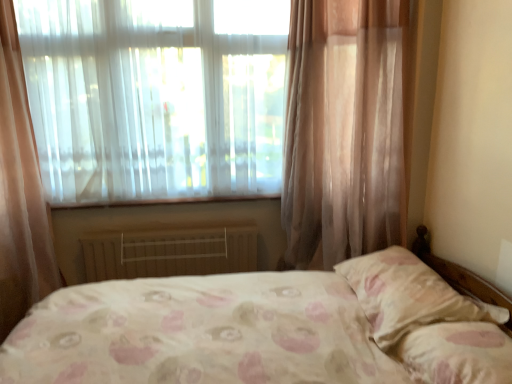
Locate an element on the screen. Image resolution: width=512 pixels, height=384 pixels. white painted metal radiator at lower center is located at coordinates (170, 251).

Describe the element at coordinates (457, 353) in the screenshot. This screenshot has width=512, height=384. I see `pink floral fabric pillow at lower right, which is the second pillow in back-to-front order` at that location.

The image size is (512, 384). Find the location of `pink floral fabric pillow at right, positioned as the first pillow in back-to-front order`. pink floral fabric pillow at right, positioned as the first pillow in back-to-front order is located at coordinates (408, 295).

Identify the location of translucent fabric at upper left. Image resolution: width=512 pixels, height=384 pixels. (156, 96).

Find the location of a particular element. white painted metal radiator at lower center is located at coordinates (170, 251).

What's the angular difference between pink floral fabric pillow at lower right, the 1th pillow from the front, and pink floral fabric pillow at right, positioned as the first pillow in back-to-front order,'s facing directions?

They differ by 0.00109 degrees in their facing directions.

Is pink floral fabric pillow at lower right, the 1th pillow from the front, not inside pink floral fabric pillow at right, positioned as the first pillow in back-to-front order?

Absolutely, pink floral fabric pillow at lower right, the 1th pillow from the front, is external to pink floral fabric pillow at right, positioned as the first pillow in back-to-front order.

Considering the positions of points (469, 365) and (404, 282), is point (469, 365) farther from camera compared to point (404, 282)?

No, (469, 365) is in front of (404, 282).

How many degrees apart are the facing directions of translucent fabric at upper left and white painted metal radiator at lower center?

The angular difference between translucent fabric at upper left and white painted metal radiator at lower center is 0.761 degrees.

Are translucent fabric at upper left and white painted metal radiator at lower center beside each other?

translucent fabric at upper left and white painted metal radiator at lower center are not in contact.

From their relative heights in the image, would you say translucent fabric at upper left is taller or shorter than white painted metal radiator at lower center?

translucent fabric at upper left is taller than white painted metal radiator at lower center.

Is translucent fabric at upper left inside the boundaries of pink floral fabric pillow at right, the 2th pillow in the front-to-back sequence, or outside?

translucent fabric at upper left exists outside the volume of pink floral fabric pillow at right, the 2th pillow in the front-to-back sequence.

Is translucent fabric at upper left bigger than pink floral fabric pillow at right, positioned as the first pillow in back-to-front order?

Indeed, translucent fabric at upper left has a larger size compared to pink floral fabric pillow at right, positioned as the first pillow in back-to-front order.

Which object is positioned more to the right, translucent fabric at upper left or pink floral fabric pillow at right, positioned as the first pillow in back-to-front order?

From the viewer's perspective, pink floral fabric pillow at right, positioned as the first pillow in back-to-front order, appears more on the right side.

From the image's perspective, relative to pink floral fabric pillow at right, the 2th pillow in the front-to-back sequence, is translucent fabric at upper left above or below?

translucent fabric at upper left is situated higher than pink floral fabric pillow at right, the 2th pillow in the front-to-back sequence, in the image.

Based on their positions, is white painted metal radiator at lower center located to the left or right of pink floral fabric pillow at lower right, which is the second pillow in back-to-front order?

Clearly, white painted metal radiator at lower center is on the left of pink floral fabric pillow at lower right, which is the second pillow in back-to-front order, in the image.

From a real-world perspective, is white painted metal radiator at lower center physically located above or below pink floral fabric pillow at lower right, the 1th pillow from the front?

Clearly, from a real-world perspective, white painted metal radiator at lower center is below pink floral fabric pillow at lower right, the 1th pillow from the front.

Is white painted metal radiator at lower center facing away from pink floral fabric pillow at lower right, the 1th pillow from the front?

No, pink floral fabric pillow at lower right, the 1th pillow from the front, is not at the back of white painted metal radiator at lower center.

Is white painted metal radiator at lower center spatially inside translucent fabric at upper left, or outside of it?

white painted metal radiator at lower center is located beyond the bounds of translucent fabric at upper left.

At what (x,y) coordinates should I click in order to perform the action: click on radiator that appears on the left of translucent fabric at upper left. Please return your answer as a coordinate pair (x, y). Looking at the image, I should click on (170, 251).

Between point (229, 250) and point (91, 127), which one is positioned behind?

The point (229, 250) is more distant.

From the image's perspective, is white painted metal radiator at lower center located above or below translucent fabric at upper left?

white painted metal radiator at lower center is situated lower than translucent fabric at upper left in the image.

From a real-world perspective, is pink floral fabric pillow at lower right, the 1th pillow from the front, above or below translucent fabric at upper left?

Clearly, from a real-world perspective, pink floral fabric pillow at lower right, the 1th pillow from the front, is below translucent fabric at upper left.

From the image's perspective, is pink floral fabric pillow at lower right, which is the second pillow in back-to-front order, above or below translucent fabric at upper left?

pink floral fabric pillow at lower right, which is the second pillow in back-to-front order, is situated lower than translucent fabric at upper left in the image.

Which of these two, pink floral fabric pillow at lower right, which is the second pillow in back-to-front order, or translucent fabric at upper left, stands taller?

Standing taller between the two is translucent fabric at upper left.

Does pink floral fabric pillow at lower right, the 1th pillow from the front, turn towards translucent fabric at upper left?

No, pink floral fabric pillow at lower right, the 1th pillow from the front, is not aimed at translucent fabric at upper left.

Which of these two, pink floral fabric pillow at right, the 2th pillow in the front-to-back sequence, or white painted metal radiator at lower center, is bigger?

With larger size is pink floral fabric pillow at right, the 2th pillow in the front-to-back sequence.

From a real-world perspective, is pink floral fabric pillow at right, positioned as the first pillow in back-to-front order, positioned above or below white painted metal radiator at lower center?

pink floral fabric pillow at right, positioned as the first pillow in back-to-front order, is situated higher than white painted metal radiator at lower center in the real world.

Which object is positioned more to the right, pink floral fabric pillow at right, the 2th pillow in the front-to-back sequence, or white painted metal radiator at lower center?

From the viewer's perspective, pink floral fabric pillow at right, the 2th pillow in the front-to-back sequence, appears more on the right side.

Which is correct: pink floral fabric pillow at right, the 2th pillow in the front-to-back sequence, is inside white painted metal radiator at lower center, or outside of it?

pink floral fabric pillow at right, the 2th pillow in the front-to-back sequence, is outside white painted metal radiator at lower center.

Locate an element on the screen. pillow in front of the pink floral fabric pillow at right, the 2th pillow in the front-to-back sequence is located at coordinates 457,353.

In the image, there is a translucent fabric at upper left. Where is `radiator below it (from the image's perspective)`? Image resolution: width=512 pixels, height=384 pixels. radiator below it (from the image's perspective) is located at coordinates [x=170, y=251].

Looking at the image, which one is located closer to pink floral fabric pillow at lower right, which is the second pillow in back-to-front order, white painted metal radiator at lower center or translucent fabric at upper left?

white painted metal radiator at lower center lies closer to pink floral fabric pillow at lower right, which is the second pillow in back-to-front order, than the other object.

Based on their spatial positions, is translucent fabric at upper left or white painted metal radiator at lower center further from pink floral fabric pillow at right, the 2th pillow in the front-to-back sequence?

translucent fabric at upper left is positioned further to the anchor pink floral fabric pillow at right, the 2th pillow in the front-to-back sequence.

Considering their positions, is pink floral fabric pillow at right, positioned as the first pillow in back-to-front order, positioned further to pink floral fabric pillow at lower right, which is the second pillow in back-to-front order, than white painted metal radiator at lower center?

white painted metal radiator at lower center is further to pink floral fabric pillow at lower right, which is the second pillow in back-to-front order.

From the image, which object appears to be nearer to pink floral fabric pillow at right, positioned as the first pillow in back-to-front order, translucent fabric at upper left or pink floral fabric pillow at lower right, which is the second pillow in back-to-front order?

Among the two, pink floral fabric pillow at lower right, which is the second pillow in back-to-front order, is located nearer to pink floral fabric pillow at right, positioned as the first pillow in back-to-front order.

In the scene shown: Based on their spatial positions, is white painted metal radiator at lower center or pink floral fabric pillow at lower right, the 1th pillow from the front, closer to translucent fabric at upper left?

The object closer to translucent fabric at upper left is white painted metal radiator at lower center.

Based on their spatial positions, is pink floral fabric pillow at right, the 2th pillow in the front-to-back sequence, or pink floral fabric pillow at lower right, which is the second pillow in back-to-front order, closer to translucent fabric at upper left?

pink floral fabric pillow at right, the 2th pillow in the front-to-back sequence, is closer to translucent fabric at upper left.

Estimate the real-world distances between objects in this image. Which object is further from translucent fabric at upper left, pink floral fabric pillow at lower right, which is the second pillow in back-to-front order, or white painted metal radiator at lower center?

pink floral fabric pillow at lower right, which is the second pillow in back-to-front order, is further to translucent fabric at upper left.

Which object lies further to the anchor point pink floral fabric pillow at lower right, which is the second pillow in back-to-front order, pink floral fabric pillow at right, the 2th pillow in the front-to-back sequence, or translucent fabric at upper left?

translucent fabric at upper left lies further to pink floral fabric pillow at lower right, which is the second pillow in back-to-front order, than the other object.

Where is `window situated between white painted metal radiator at lower center and pink floral fabric pillow at right, the 2th pillow in the front-to-back sequence, from left to right`? This screenshot has width=512, height=384. window situated between white painted metal radiator at lower center and pink floral fabric pillow at right, the 2th pillow in the front-to-back sequence, from left to right is located at coordinates (156, 96).

Identify the location of window between pink floral fabric pillow at lower right, the 1th pillow from the front, and white painted metal radiator at lower center in the front-back direction. Image resolution: width=512 pixels, height=384 pixels. (156, 96).

This screenshot has width=512, height=384. In order to click on pillow situated between translucent fabric at upper left and pink floral fabric pillow at lower right, which is the second pillow in back-to-front order, from left to right in this screenshot , I will do `click(408, 295)`.

The height and width of the screenshot is (384, 512). What are the coordinates of `pillow located between pink floral fabric pillow at lower right, which is the second pillow in back-to-front order, and white painted metal radiator at lower center in the depth direction` in the screenshot? It's located at (408, 295).